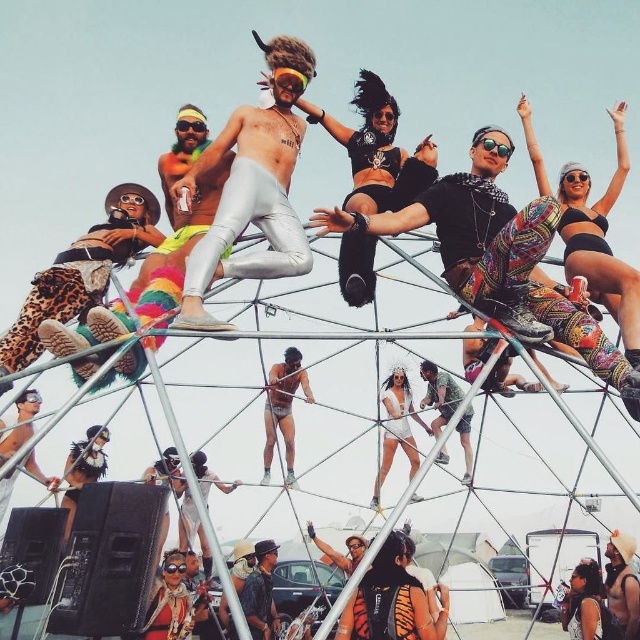
Which is more to the right, metallic silver shorts at center or camouflage fabric shorts at center?

From the viewer's perspective, camouflage fabric shorts at center appears more on the right side.

Between metallic silver shorts at center and camouflage fabric shorts at center, which one is positioned higher?

metallic silver shorts at center is higher up.

The width and height of the screenshot is (640, 640). Identify the location of metallic silver shorts at center. click(x=282, y=410).

I want to click on metallic silver shorts at center, so click(x=282, y=410).

Who is more forward, (400,380) or (433,364)?

Point (433,364) is more forward.

Between point (387, 436) and point (433, 420), which one is positioned in front?

Point (433, 420)

This screenshot has height=640, width=640. Identify the location of white matte dress at center. (396, 428).

Is metallic silver shorts at center wider than white matte dress at center?

Incorrect, metallic silver shorts at center's width does not surpass white matte dress at center's.

Is metallic silver shorts at center closer to camera compared to white matte dress at center?

No, it is not.

Is point (298, 349) closer to viewer compared to point (401, 394)?

No, (298, 349) is further to viewer.

At what (x,y) coordinates should I click in order to perform the action: click on metallic silver shorts at center. Please return your answer as a coordinate pair (x, y). This screenshot has width=640, height=640. Looking at the image, I should click on (282, 410).